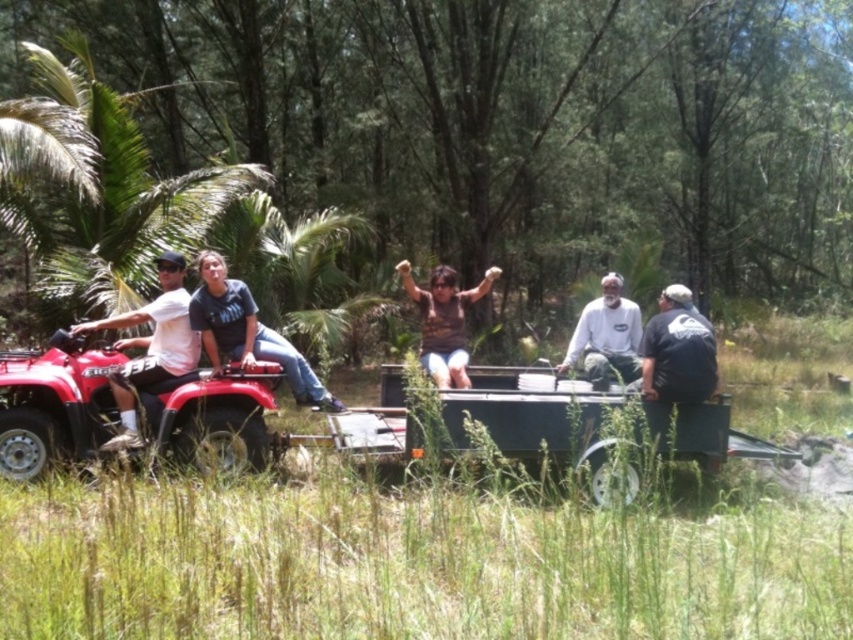
Question: Which is farther from the brown matte shirt at center?

Choices:
 (A) white matte shirt on the left
 (B) green leafy forest at center

Answer: (B)

Question: Which of these objects is positioned farthest from the black matte shirt at right?

Choices:
 (A) white matte shirt on the left
 (B) brown matte shirt at center
 (C) green leafy forest at center

Answer: (C)

Question: Does green leafy forest at center appear on the left side of black matte shirt at right?

Choices:
 (A) yes
 (B) no

Answer: (B)

Question: Can you confirm if black matte shirt at right is positioned to the left of brown matte shirt at center?

Choices:
 (A) yes
 (B) no

Answer: (B)

Question: Can you confirm if green leafy forest at center is positioned below brown matte shirt at center?

Choices:
 (A) no
 (B) yes

Answer: (A)

Question: Which point appears farthest from the camera in this image?

Choices:
 (A) 79,440
 (B) 502,196
 (C) 119,372

Answer: (B)